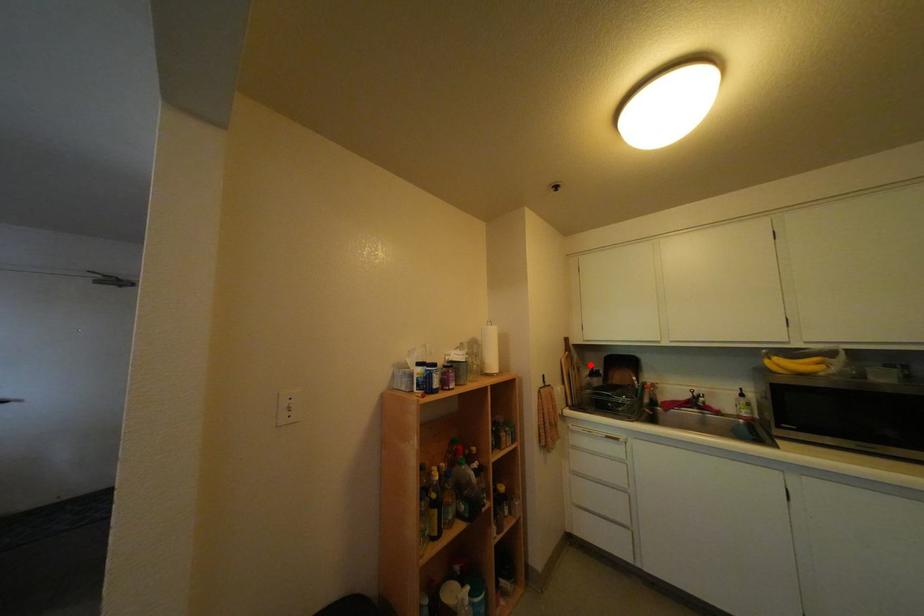
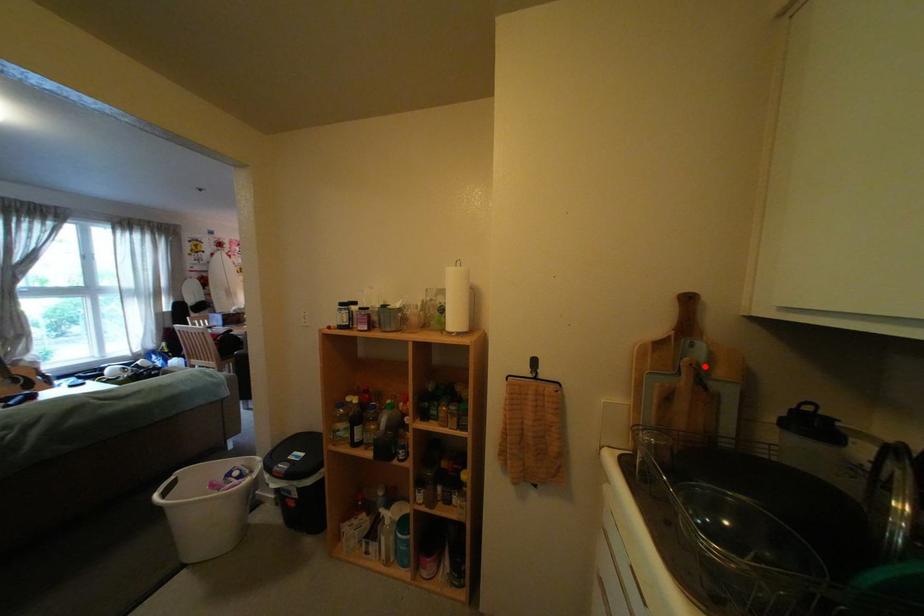
I am providing you with two images of the same scene from different viewpoints. A red point is marked on the first image and another point is marked on the second image. Is the marked point in image1 the same physical position as the marked point in image2?

Yes